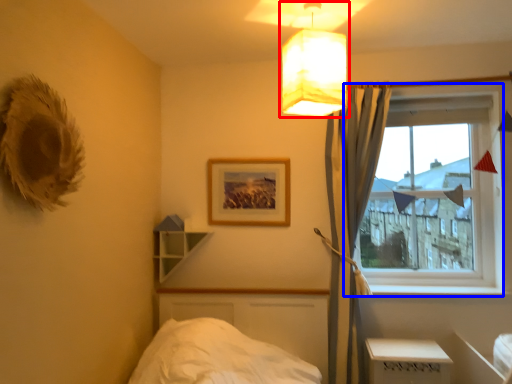
Question: Which object is closer to the camera taking this photo, lamp (highlighted by a red box) or window (highlighted by a blue box)?

Choices:
 (A) lamp
 (B) window

Answer: (A)